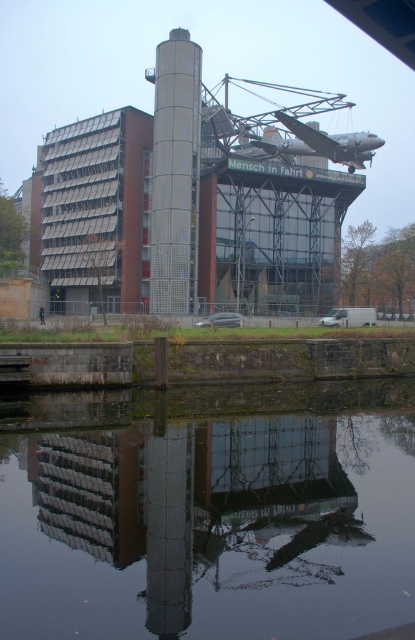
You are an architect evaluating the building design. You need to determine if the transparent glass water at center can fit through the entrance door which is as wide as the gray metallic silo at center. Can it fit?

The transparent glass water at center is wider than the gray metallic silo at center, so it cannot fit through the entrance door which is as wide as the gray metallic silo at center.

You are a visitor standing in front of the modern building near the water. You notice two elements at the center of the building. One is the transparent glass water at center and the other is the gray metallic silo at center. Which of these two is taller?

The gray metallic silo at center is taller than the transparent glass water at center according to the description.